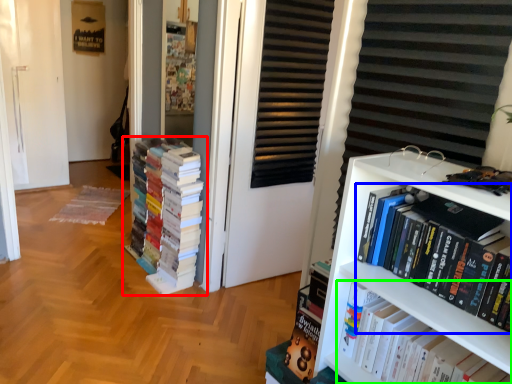
Question: Estimate the real-world distances between objects in this image. Which object is closer to book (highlighted by a red box), book (highlighted by a blue box) or book (highlighted by a green box)?

Choices:
 (A) book
 (B) book

Answer: (B)